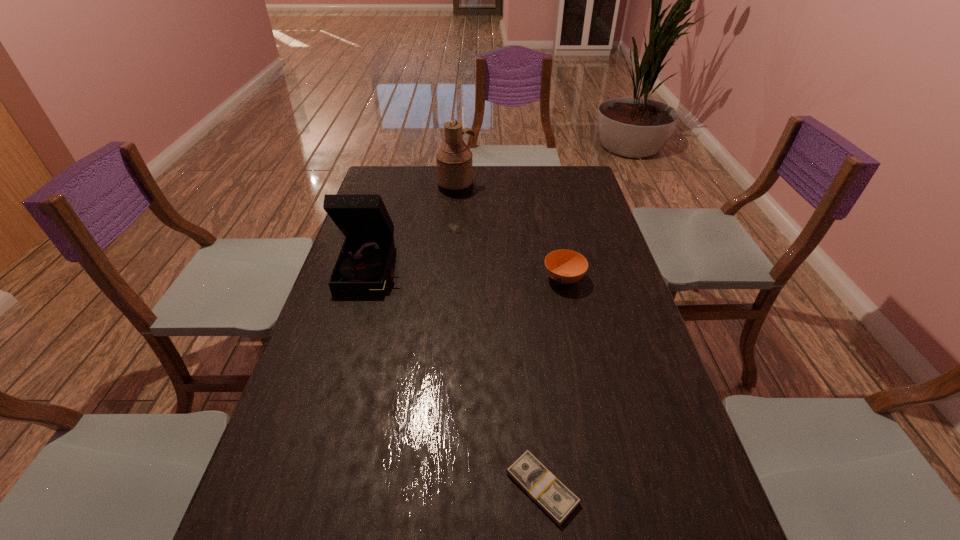
Locate an element on the screen. The image size is (960, 540). object located in the far edge section of the desktop is located at coordinates (454, 160).

Locate an element on the screen. object positioned at the left edge is located at coordinates (363, 266).

At what (x,y) coordinates should I click in order to perform the action: click on object that is positioned at the right edge. Please return your answer as a coordinate pair (x, y). This screenshot has height=540, width=960. Looking at the image, I should click on (564, 266).

In the image, there is a desktop. Identify the location of blank space at the far edge. This screenshot has width=960, height=540. (480, 175).

In the image, there is a desktop. At what (x,y) coordinates should I click in order to perform the action: click on free space at the left edge. Please return your answer as a coordinate pair (x, y). This screenshot has height=540, width=960. Looking at the image, I should click on (333, 493).

Where is `free spot at the right edge of the desktop`? This screenshot has width=960, height=540. free spot at the right edge of the desktop is located at coordinates (601, 295).

I want to click on free spot between the phonograph_record and the pitcher, so click(415, 227).

The height and width of the screenshot is (540, 960). In order to click on unoccupied position between the phonograph_record and the shortest object in this screenshot , I will do `click(458, 378)`.

The image size is (960, 540). I want to click on free spot between the nearest object and the phonograph_record, so click(x=458, y=378).

At what (x,y) coordinates should I click in order to perform the action: click on free spot between the soup bowl and the phonograph_record. Please return your answer as a coordinate pair (x, y). Image resolution: width=960 pixels, height=540 pixels. Looking at the image, I should click on (468, 273).